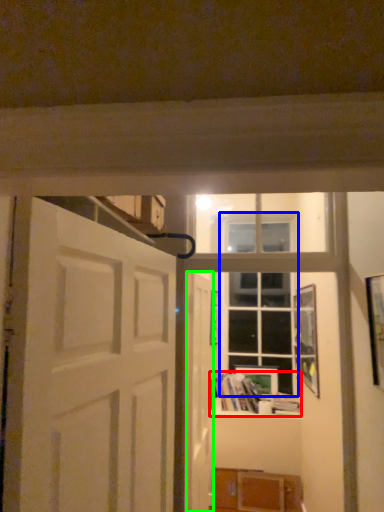
Question: Based on their relative distances, which object is farther from book (highlighted by a red box)? Choose from window (highlighted by a blue box) and door (highlighted by a green box).

Choices:
 (A) window
 (B) door

Answer: (B)